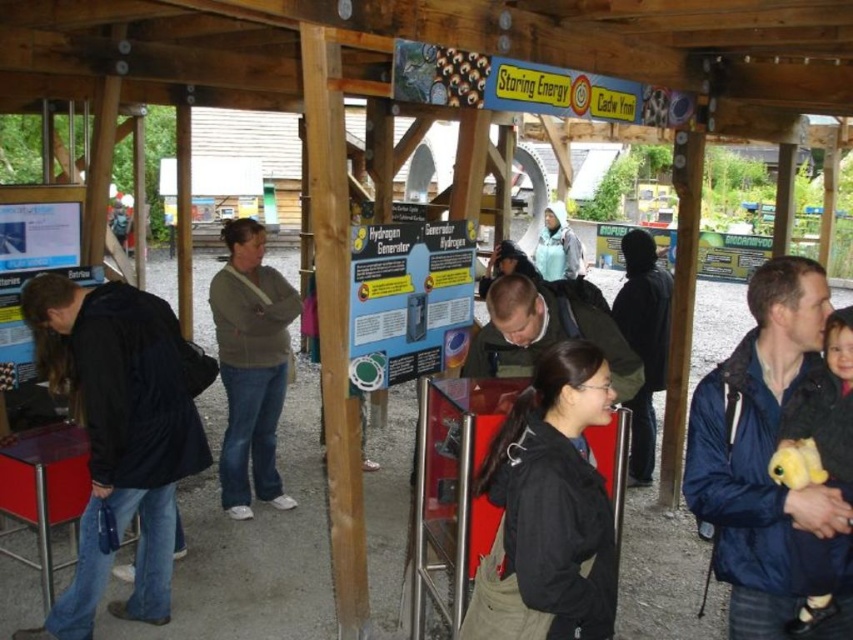
Question: Is black matte jacket at center to the left of matte green jacket at center from the viewer's perspective?

Choices:
 (A) no
 (B) yes

Answer: (A)

Question: Which object is the closest to the blue fabric jacket at center?

Choices:
 (A) black matte jacket at center
 (B) light blue fabric at center
 (C) dark blue jacket at left
 (D) matte green jacket at center

Answer: (A)

Question: Which of the following is the farthest from the observer?

Choices:
 (A) blue fabric jacket at center
 (B) light blue fabric at center
 (C) matte green jacket at center

Answer: (B)

Question: Is black matte jacket at center thinner than matte green jacket at center?

Choices:
 (A) yes
 (B) no

Answer: (A)

Question: Can you confirm if black matte jacket at center is positioned to the right of light blue fabric at center?

Choices:
 (A) no
 (B) yes

Answer: (A)

Question: Estimate the real-world distances between objects in this image. Which object is farther from the blue fabric jacket at center?

Choices:
 (A) light blue fabric at center
 (B) black matte jacket at center

Answer: (A)